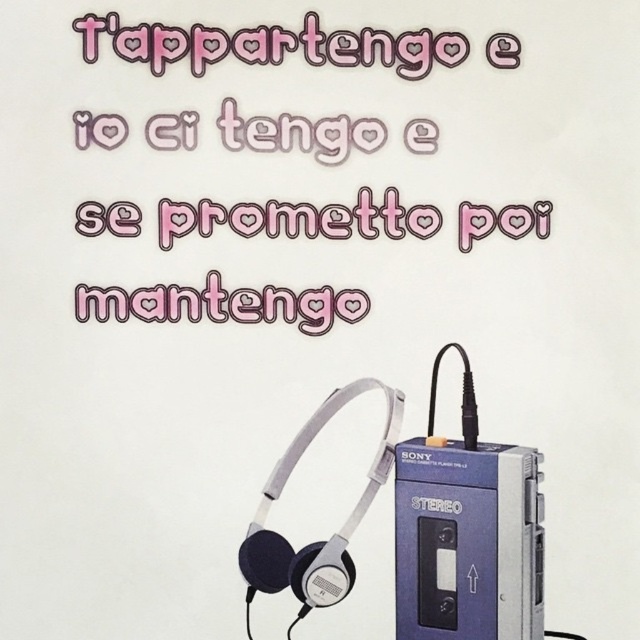
Question: Does pink paper text at upper center have a lesser width compared to blue plastic cassette at lower right?

Choices:
 (A) no
 (B) yes

Answer: (A)

Question: Does pink paper text at upper center have a smaller size compared to blue plastic cassette at lower right?

Choices:
 (A) no
 (B) yes

Answer: (A)

Question: Is pink paper text at upper center to the left of blue plastic cassette at lower right from the viewer's perspective?

Choices:
 (A) no
 (B) yes

Answer: (B)

Question: Which of the following is the closest to the observer?

Choices:
 (A) pink paper text at upper center
 (B) blue plastic cassette at lower right

Answer: (B)

Question: Which point is farther to the camera?

Choices:
 (A) (516, 572)
 (B) (355, 52)

Answer: (B)